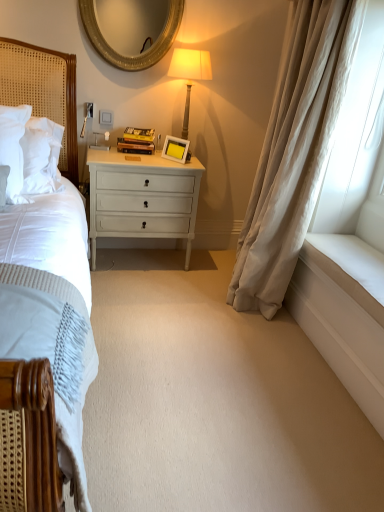
Question: Does beige silk curtain at right have a greater width compared to white matte picture frame at center?

Choices:
 (A) yes
 (B) no

Answer: (A)

Question: From a real-world perspective, is beige silk curtain at right located higher than white matte picture frame at center?

Choices:
 (A) no
 (B) yes

Answer: (B)

Question: Are beige silk curtain at right and white matte picture frame at center located far from each other?

Choices:
 (A) no
 (B) yes

Answer: (A)

Question: Does beige silk curtain at right appear on the right side of white matte picture frame at center?

Choices:
 (A) no
 (B) yes

Answer: (B)

Question: Does beige silk curtain at right come behind white matte picture frame at center?

Choices:
 (A) no
 (B) yes

Answer: (A)

Question: Would you say beige silk curtain at right is outside white matte picture frame at center?

Choices:
 (A) yes
 (B) no

Answer: (A)

Question: From a real-world perspective, is matte gold lamp at upper center physically below gold textured mirror at upper center?

Choices:
 (A) no
 (B) yes

Answer: (B)

Question: Considering the relative sizes of matte gold lamp at upper center and gold textured mirror at upper center in the image provided, is matte gold lamp at upper center smaller than gold textured mirror at upper center?

Choices:
 (A) no
 (B) yes

Answer: (A)

Question: Is matte gold lamp at upper center bigger than gold textured mirror at upper center?

Choices:
 (A) yes
 (B) no

Answer: (A)

Question: Can you confirm if matte gold lamp at upper center is positioned to the right of gold textured mirror at upper center?

Choices:
 (A) no
 (B) yes

Answer: (B)

Question: Can you confirm if matte gold lamp at upper center is positioned to the left of gold textured mirror at upper center?

Choices:
 (A) no
 (B) yes

Answer: (A)

Question: Does matte gold lamp at upper center turn towards gold textured mirror at upper center?

Choices:
 (A) yes
 (B) no

Answer: (B)

Question: Considering the relative sizes of matte gold lamp at upper center and white matte picture frame at center in the image provided, is matte gold lamp at upper center taller than white matte picture frame at center?

Choices:
 (A) yes
 (B) no

Answer: (A)